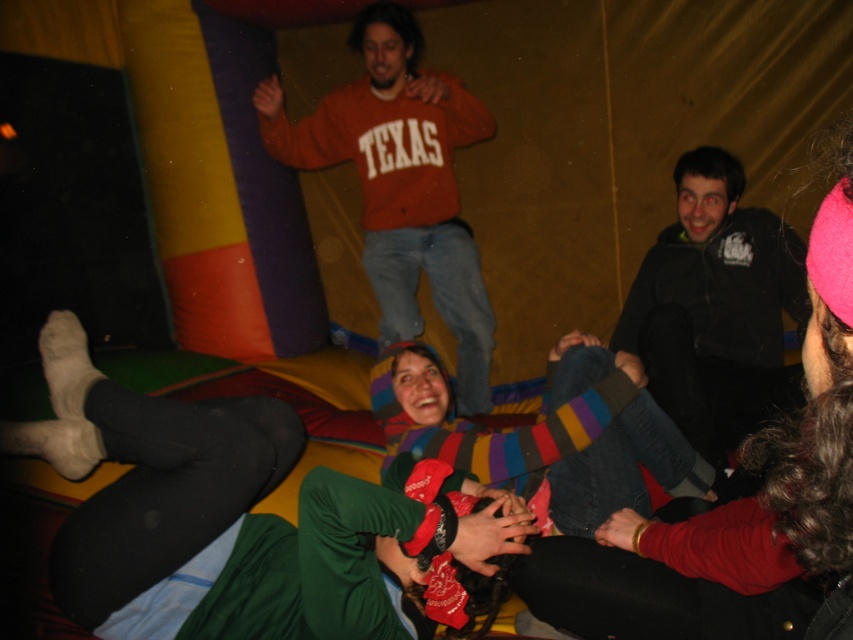
Question: Estimate the real-world distances between objects in this image. Which object is farther from the striped sweater at center?

Choices:
 (A) matte red sweatshirt at center
 (B) black soft jacket at upper right

Answer: (A)

Question: Does striped sweater at center appear on the right side of black soft jacket at upper right?

Choices:
 (A) no
 (B) yes

Answer: (A)

Question: Can you confirm if striped sweater at center is positioned below matte red sweatshirt at center?

Choices:
 (A) yes
 (B) no

Answer: (A)

Question: Does striped sweater at center come in front of black soft jacket at upper right?

Choices:
 (A) yes
 (B) no

Answer: (A)

Question: Which point is closer to the camera taking this photo?

Choices:
 (A) (325, 145)
 (B) (740, 588)
 (C) (726, 259)

Answer: (B)

Question: Which point is farther to the camera?

Choices:
 (A) matte red sweatshirt at center
 (B) striped sweater at center

Answer: (A)